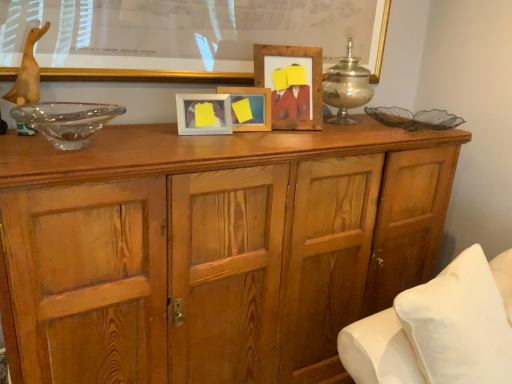
Locate an element on the screen. This screenshot has width=512, height=384. free location in front of transparent glass bowl at left is located at coordinates (48, 154).